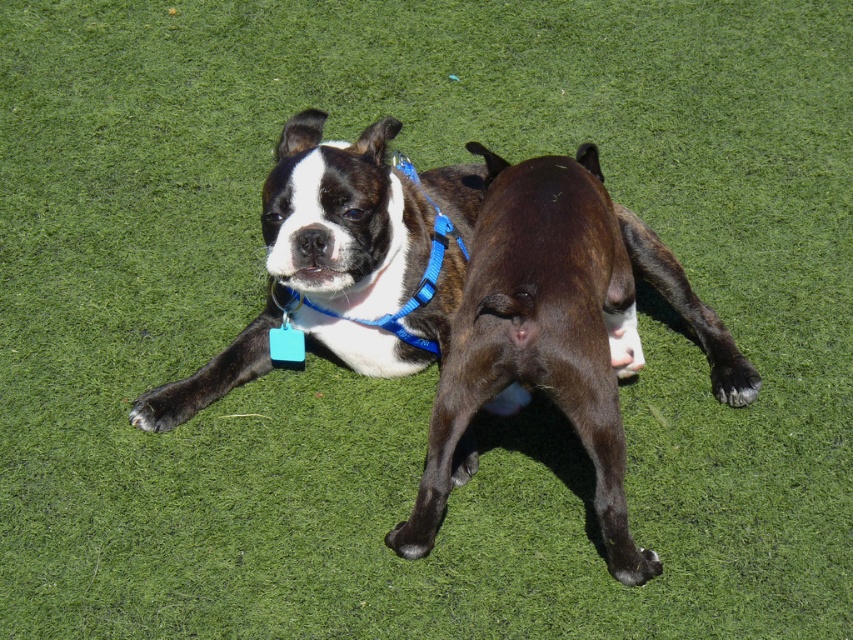
Question: Among these objects, which one is nearest to the camera?

Choices:
 (A) brown matte dog at center
 (B) shiny black dog at center

Answer: (A)

Question: Can you confirm if shiny black dog at center is positioned below brown matte dog at center?

Choices:
 (A) yes
 (B) no

Answer: (B)

Question: Which point is farther to the camera?

Choices:
 (A) shiny black dog at center
 (B) brown matte dog at center

Answer: (A)

Question: Observing the image, what is the correct spatial positioning of shiny black dog at center in reference to brown matte dog at center?

Choices:
 (A) left
 (B) right

Answer: (A)

Question: Does shiny black dog at center have a lesser width compared to brown matte dog at center?

Choices:
 (A) yes
 (B) no

Answer: (A)